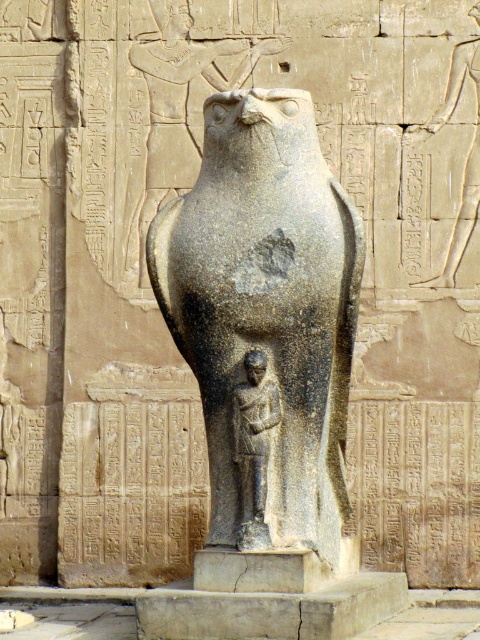
Question: Does granite statue of falcon at center have a smaller size compared to dark gray stone figure at center?

Choices:
 (A) yes
 (B) no

Answer: (A)

Question: Is granite statue of falcon at center positioned in front of dark gray stone figure at center?

Choices:
 (A) no
 (B) yes

Answer: (A)

Question: Which point is closer to the camera?

Choices:
 (A) (265, 365)
 (B) (192, 333)

Answer: (A)

Question: Which of the following is the farthest from the observer?

Choices:
 (A) (208, 384)
 (B) (266, 448)

Answer: (A)

Question: Is granite statue of falcon at center positioned in front of dark gray stone figure at center?

Choices:
 (A) no
 (B) yes

Answer: (A)